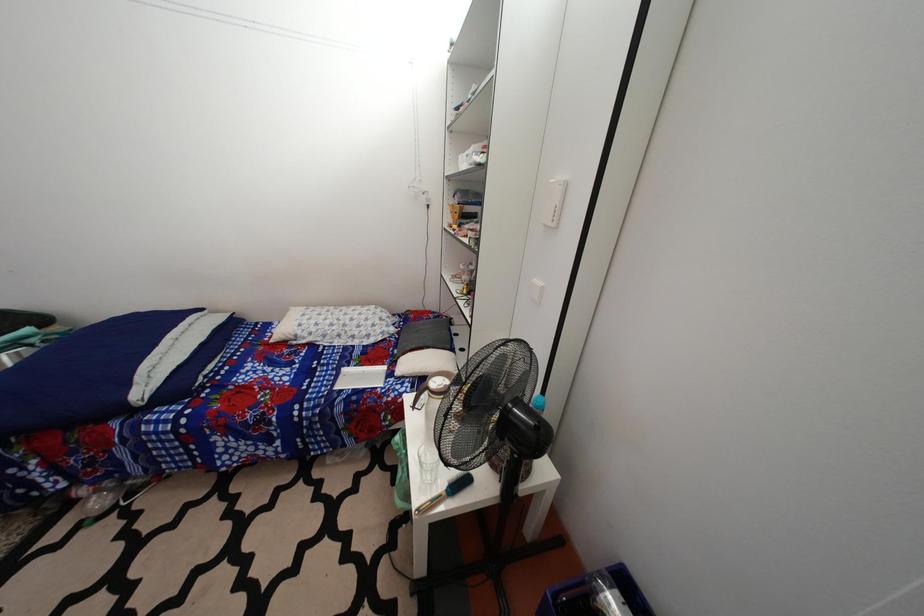
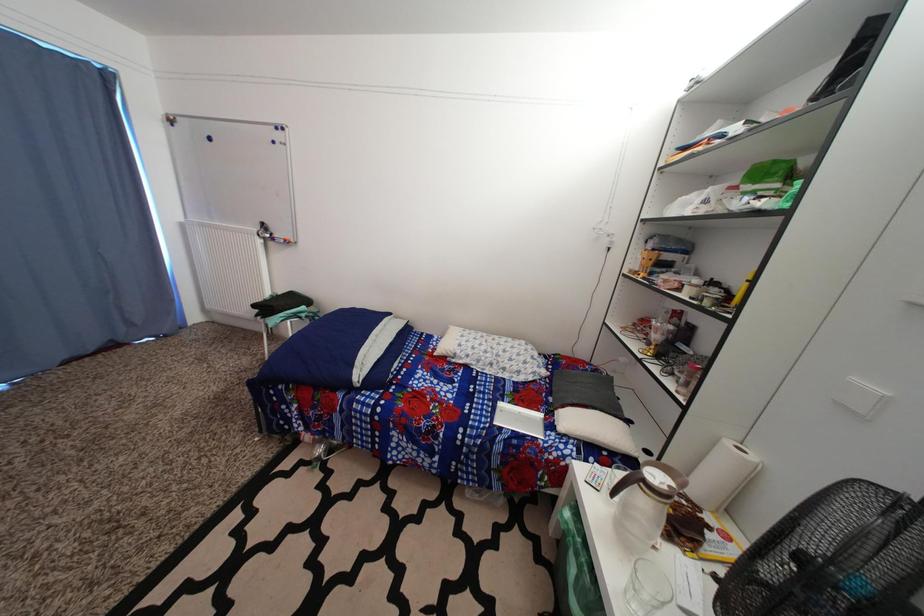
Question: Based on the continuous images, in which direction is the camera rotating? Reply with the corresponding letter.

Choices:
 (A) Left
 (B) Right
 (C) Up
 (D) Down

Answer: (A)